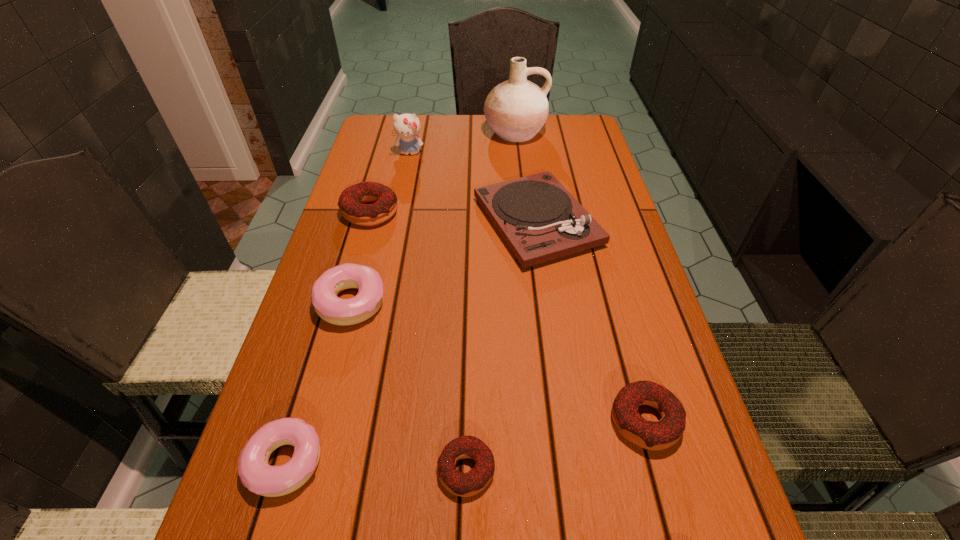
Find the location of a particular element. The image size is (960, 540). the tallest object is located at coordinates (516, 110).

Identify the location of pottery. The height and width of the screenshot is (540, 960). (516, 110).

This screenshot has width=960, height=540. What are the coordinates of `the second tallest object` in the screenshot? It's located at (407, 126).

The width and height of the screenshot is (960, 540). Find the location of `phonograph_record`. phonograph_record is located at coordinates (537, 217).

Locate an element on the screen. Image resolution: width=960 pixels, height=540 pixels. the farthest chocolate doughnut is located at coordinates (351, 200).

This screenshot has height=540, width=960. I want to click on the farthest doughnut, so click(x=351, y=200).

I want to click on the bigger pink doughnut, so click(x=332, y=309).

Locate an element on the screen. This screenshot has width=960, height=540. the fourth nearest doughnut is located at coordinates (332, 309).

Image resolution: width=960 pixels, height=540 pixels. Identify the location of the rightmost doughnut. (662, 434).

This screenshot has width=960, height=540. What are the coordinates of `the rightmost chocolate doughnut` in the screenshot? It's located at (662, 434).